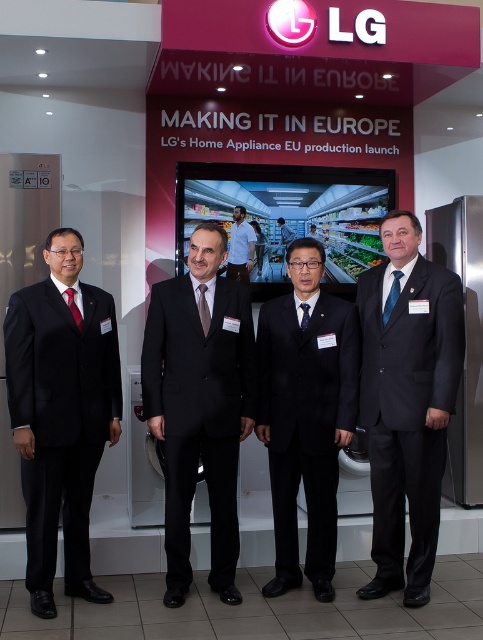
You are organizing a photo shoot for a men fashion magazine. You have two matte black suits in your collection. The matte black suit at left and the black matte suit at center. Which one is bigger in size?

The matte black suit at left is larger in size than the black matte suit at center.

You are a photographer at the event and need to adjust the lighting to ensure both the matte black suit at left and the matte red tie at center are well lit. Considering their sizes, which one might require more focused lighting to ensure visibility?

The matte black suit at left is bigger than the matte red tie at center, so it might require more focused lighting to ensure its details are visible.